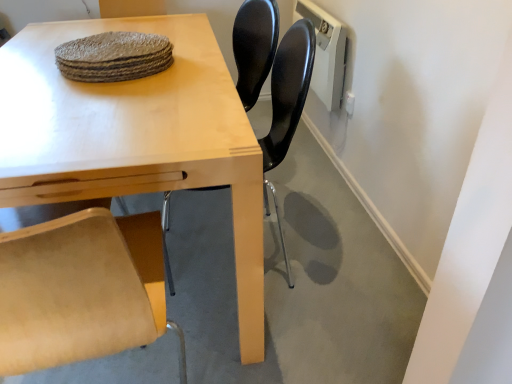
Question: From a real-world perspective, is rough woven placemat at upper center physically below light wood table at center?

Choices:
 (A) yes
 (B) no

Answer: (B)

Question: Considering the relative positions of rough woven placemat at upper center and light wood table at center in the image provided, is rough woven placemat at upper center to the right of light wood table at center from the viewer's perspective?

Choices:
 (A) yes
 (B) no

Answer: (A)

Question: Considering the relative sizes of rough woven placemat at upper center and light wood table at center in the image provided, is rough woven placemat at upper center shorter than light wood table at center?

Choices:
 (A) yes
 (B) no

Answer: (A)

Question: Is rough woven placemat at upper center turned away from light wood table at center?

Choices:
 (A) yes
 (B) no

Answer: (B)

Question: Is the position of rough woven placemat at upper center less distant than that of light wood table at center?

Choices:
 (A) yes
 (B) no

Answer: (B)

Question: From the image's perspective, is rough woven placemat at upper center below light wood table at center?

Choices:
 (A) no
 (B) yes

Answer: (A)

Question: Does light wood table at center have a smaller size compared to rough woven placemat at upper center?

Choices:
 (A) yes
 (B) no

Answer: (B)

Question: Considering the relative sizes of light wood table at center and rough woven placemat at upper center in the image provided, is light wood table at center wider than rough woven placemat at upper center?

Choices:
 (A) yes
 (B) no

Answer: (A)

Question: Does light wood table at center turn towards rough woven placemat at upper center?

Choices:
 (A) no
 (B) yes

Answer: (A)

Question: Is light wood table at center positioned with its back to rough woven placemat at upper center?

Choices:
 (A) yes
 (B) no

Answer: (B)

Question: From a real-world perspective, is light wood table at center positioned over rough woven placemat at upper center based on gravity?

Choices:
 (A) no
 (B) yes

Answer: (A)

Question: Does light wood table at center have a larger size compared to rough woven placemat at upper center?

Choices:
 (A) no
 (B) yes

Answer: (B)

Question: From a real-world perspective, does light wood table at center stand above black plastic chair at center?

Choices:
 (A) no
 (B) yes

Answer: (A)